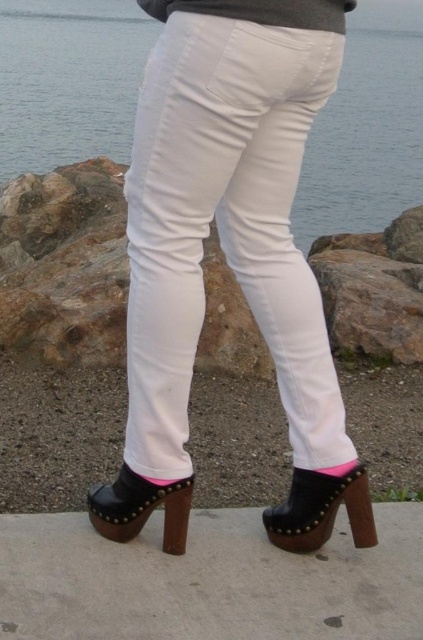
Who is more distant from viewer, (134, 54) or (329, 525)?

Positioned behind is point (134, 54).

From the picture: Does clear blue water at center appear on the right side of black studded platform shoe at lower center?

In fact, clear blue water at center is to the left of black studded platform shoe at lower center.

Image resolution: width=423 pixels, height=640 pixels. What are the coordinates of `clear blue water at center` in the screenshot? It's located at (68, 80).

Is white cotton pants at center taller than black studded platform shoe at lower center?

Yes.

Is white cotton pants at center positioned behind black studded platform shoe at lower center?

No, it is in front of black studded platform shoe at lower center.

You are a GUI agent. You are given a task and a screenshot of the screen. Output one action in this format:
    pyautogui.click(x=<x>, y=<y>)
    Task: Click on the white cotton pants at center
    Image resolution: width=423 pixels, height=640 pixels.
    Given the screenshot: What is the action you would take?
    pyautogui.click(x=225, y=227)

Who is positioned more to the right, black studded platform shoe at lower center or black leather clog at lower center?

Positioned to the right is black studded platform shoe at lower center.

Who is more forward, [364,509] or [96,486]?

Point [364,509]

Identify the location of black studded platform shoe at lower center. This screenshot has height=640, width=423. (321, 509).